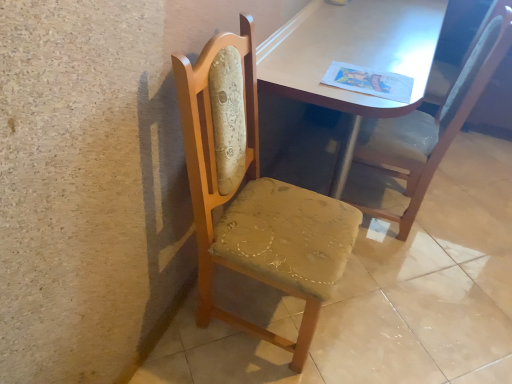
At what (x,y) coordinates should I click in order to perform the action: click on free point to the right of wooden chair at right, marked as the 2th chair in a left-to-right arrangement. Please return your answer as a coordinate pair (x, y). Looking at the image, I should click on (447, 224).